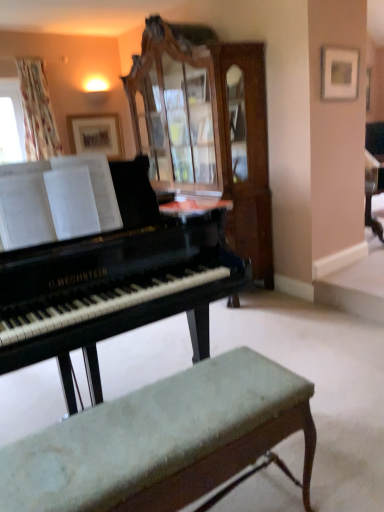
Question: Is black polished piano at center in front of or behind matte white picture frame at upper right, the 1th picture frame when ordered from front to back, in the image?

Choices:
 (A) behind
 (B) front

Answer: (B)

Question: Considering the positions of black polished piano at center and matte white picture frame at upper right, the second picture frame from the back, in the image, is black polished piano at center wider or thinner than matte white picture frame at upper right, the second picture frame from the back,?

Choices:
 (A) wide
 (B) thin

Answer: (A)

Question: Which object is the closest to the orange glossy table at center?

Choices:
 (A) matte wooden picture frame at upper center, marked as the 2th picture frame in a front-to-back arrangement
 (B) black polished piano at center
 (C) matte white picture frame at upper right, the second picture frame from the back
 (D) wooden cabinet at center
 (E) velvet green bench at lower center

Answer: (B)

Question: Which of these objects is positioned farthest from the wooden cabinet at center?

Choices:
 (A) velvet green bench at lower center
 (B) matte white picture frame at upper right, the 1th picture frame when ordered from front to back
 (C) matte wooden picture frame at upper center, marked as the 2th picture frame in a front-to-back arrangement
 (D) black polished piano at center
 (E) orange glossy table at center

Answer: (A)